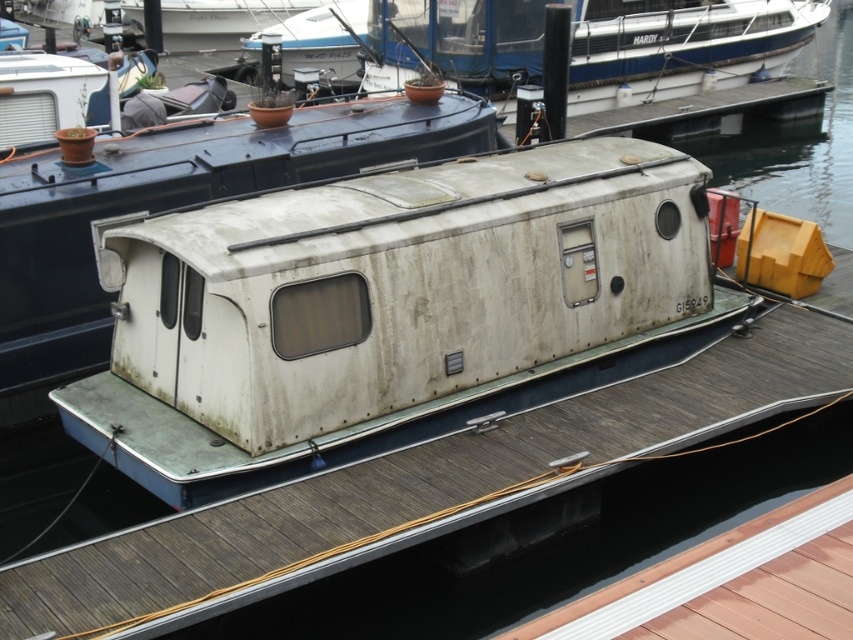
Based on the photo, you are standing on the wooden dock and see the white matte boat at center and the white matte cabin at center. Which one is located to the right side of the other?

The white matte boat at center is positioned on the right side of white matte cabin at center.

Looking at this image, you are standing on the wooden dock and want to board the white matte boat at center. What are the coordinates of the boat to help you locate it?

The white matte boat at center is located at coordinates point (392,310).